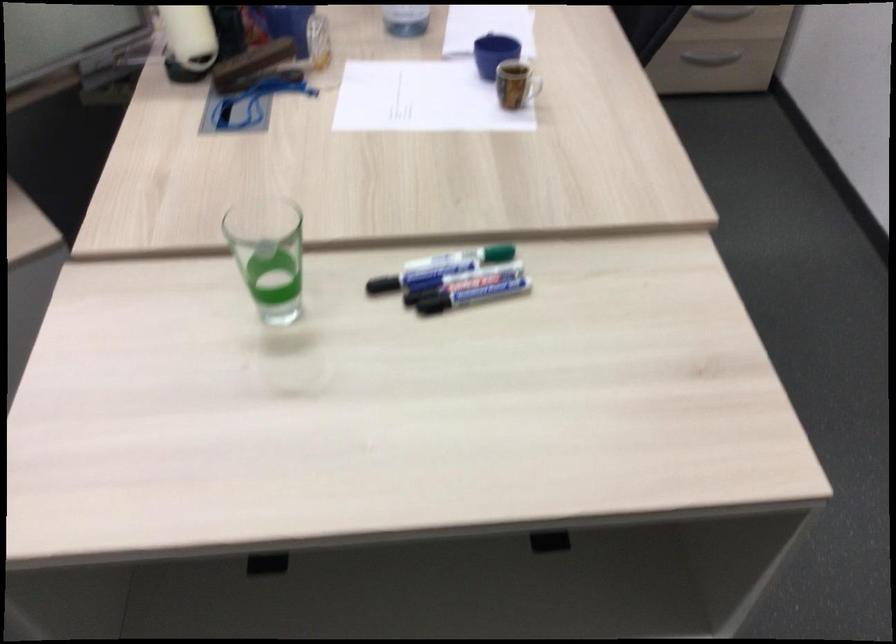
Locate an element on the screen. Image resolution: width=896 pixels, height=644 pixels. brown mug handle is located at coordinates pyautogui.click(x=531, y=88).